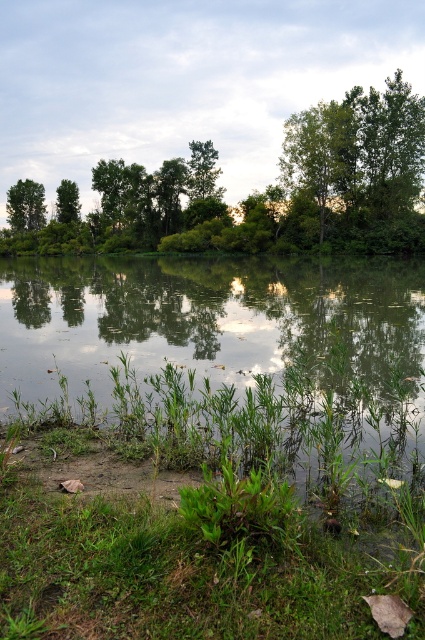
Is green leafy trees at upper center below green leafy tree at upper left?

Yes, green leafy trees at upper center is below green leafy tree at upper left.

Describe the element at coordinates (268, 189) in the screenshot. I see `green leafy trees at upper center` at that location.

This screenshot has width=425, height=640. Find the location of `green leafy trees at upper center`. green leafy trees at upper center is located at coordinates (268, 189).

Who is shorter, green leafy trees at upper center or green matte tree at upper left?

green matte tree at upper left is shorter.

Is green leafy trees at upper center further to the viewer compared to green matte tree at upper left?

No.

Locate an element on the screen. This screenshot has width=425, height=640. green leafy trees at upper center is located at coordinates (268, 189).

Who is higher up, green leafy tree at upper left or green matte tree at upper left?

green leafy tree at upper left

Is green leafy tree at upper left thinner than green matte tree at upper left?

Incorrect, green leafy tree at upper left's width is not less than green matte tree at upper left's.

Where is `green leafy tree at upper left`? green leafy tree at upper left is located at coordinates (25, 205).